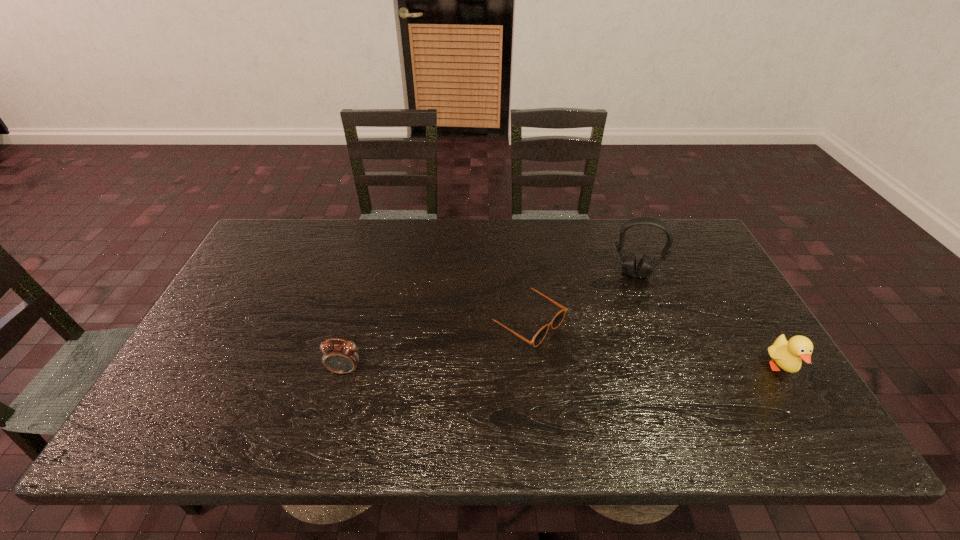
Identify the location of vacant space situated on the front-facing side of the headset. This screenshot has width=960, height=540. (615, 384).

Where is `free space located on the front-facing side of the headset`? free space located on the front-facing side of the headset is located at coordinates (626, 314).

You are a GUI agent. You are given a task and a screenshot of the screen. Output one action in this format:
    pyautogui.click(x=<x>, y=<y>)
    Task: Click on the alarm clock that is at the near edge
    
    Given the screenshot: What is the action you would take?
    pyautogui.click(x=338, y=357)

I want to click on duckling that is at the near edge, so click(x=787, y=354).

You are a GUI agent. You are given a task and a screenshot of the screen. Output one action in this format:
    pyautogui.click(x=<x>, y=<y>)
    Task: Click on the object that is positioned at the right edge
    The width and height of the screenshot is (960, 540).
    Given the screenshot: What is the action you would take?
    (787, 354)

Where is `object that is positioned at the near right corner`? This screenshot has width=960, height=540. object that is positioned at the near right corner is located at coordinates (787, 354).

In the image, there is a desktop. Where is `blank space at the far edge`? Image resolution: width=960 pixels, height=540 pixels. blank space at the far edge is located at coordinates (487, 229).

The height and width of the screenshot is (540, 960). Find the location of `free space at the near edge of the desktop`. free space at the near edge of the desktop is located at coordinates (727, 403).

Where is `free space at the left edge`? This screenshot has height=540, width=960. free space at the left edge is located at coordinates (245, 285).

Locate an element on the screen. This screenshot has height=540, width=960. vacant space at the right edge is located at coordinates (696, 330).